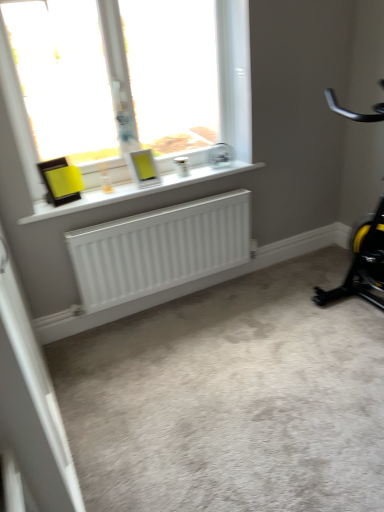
Question: From their relative heights in the image, would you say white matte radiator at lower center is taller or shorter than black/yellow plastic stationary bicycle at right?

Choices:
 (A) short
 (B) tall

Answer: (A)

Question: Based on their positions, is white matte radiator at lower center located to the left or right of black/yellow plastic stationary bicycle at right?

Choices:
 (A) left
 (B) right

Answer: (A)

Question: Which object is the farthest from the white matte radiator at lower center?

Choices:
 (A) white plastic window at upper center
 (B) white matte screen door at lower left
 (C) black/yellow plastic stationary bicycle at right
 (D) white matte radiator at lower center

Answer: (B)

Question: Based on their relative distances, which object is nearer to the black/yellow plastic stationary bicycle at right?

Choices:
 (A) white matte screen door at lower left
 (B) white plastic window at upper center
 (C) white matte radiator at lower center
 (D) white matte radiator at lower center

Answer: (C)